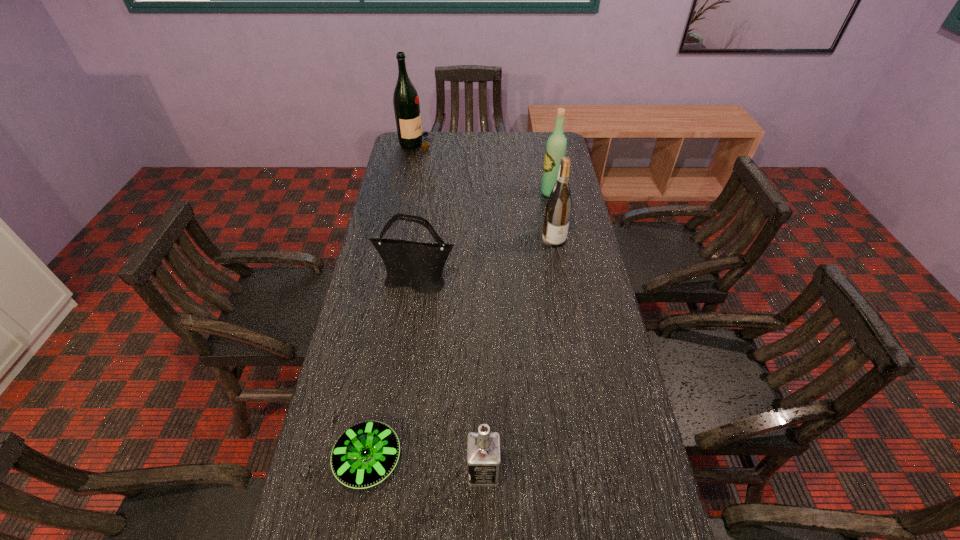
What are the coordinates of `vacant space that satisfies the following two spatial constraints: 1. on the front-facing side of the second nearest wine bottle; 2. on the front side of the nearest wine bottle` in the screenshot? It's located at (559, 239).

Where is `blank area in the image that satisfies the following two spatial constraints: 1. on the front-facing side of the second nearest wine bottle; 2. on the front side of the saucer`? The width and height of the screenshot is (960, 540). blank area in the image that satisfies the following two spatial constraints: 1. on the front-facing side of the second nearest wine bottle; 2. on the front side of the saucer is located at coordinates (601, 460).

At what (x,y) coordinates should I click in order to perform the action: click on vacant space that satisfies the following two spatial constraints: 1. on the back side of the shortest object; 2. on the surface of the farthest object. Please return your answer as a coordinate pair (x, y). The width and height of the screenshot is (960, 540). Looking at the image, I should click on (423, 144).

Find the location of `free space that satisfies the following two spatial constraints: 1. on the surface of the leftmost wine bottle; 2. on the left side of the fourth farthest object`. free space that satisfies the following two spatial constraints: 1. on the surface of the leftmost wine bottle; 2. on the left side of the fourth farthest object is located at coordinates (389, 284).

The height and width of the screenshot is (540, 960). What are the coordinates of `vacant area that satisfies the following two spatial constraints: 1. on the surface of the farthest object; 2. on the right side of the shortest object` in the screenshot? It's located at (355, 460).

What are the coordinates of `vacant space that satisfies the following two spatial constraints: 1. on the front-facing side of the fifth nearest object; 2. on the front side of the saucer` in the screenshot? It's located at (601, 460).

You are a GUI agent. You are given a task and a screenshot of the screen. Output one action in this format:
    pyautogui.click(x=<x>, y=<y>)
    Task: Click on the free space in the image that satisfies the following two spatial constraints: 1. on the back side of the shortest object; 2. on the surface of the farthest object
    Image resolution: width=960 pixels, height=540 pixels.
    Given the screenshot: What is the action you would take?
    pyautogui.click(x=423, y=144)

Identify the location of vacant space that satisfies the following two spatial constraints: 1. on the back side of the fourth farthest object; 2. on the surface of the leftmost wine bottle. Image resolution: width=960 pixels, height=540 pixels. (436, 144).